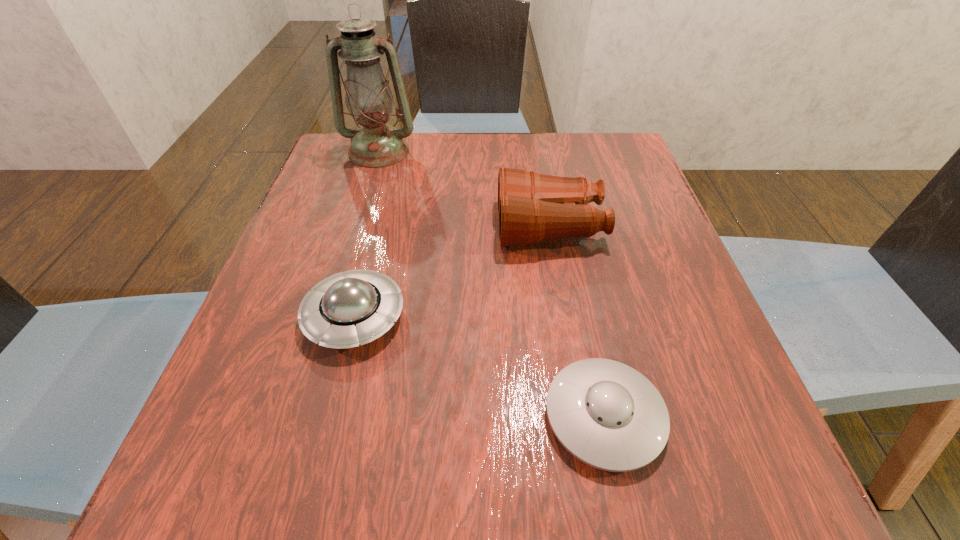
Find the location of `free region located through the lenses of the third nearest object`. free region located through the lenses of the third nearest object is located at coordinates (441, 226).

This screenshot has width=960, height=540. What are the coordinates of `vacant space located 0.260m through the lenses of the third nearest object` in the screenshot? It's located at (373, 226).

Locate an element on the screen. vacant space located 0.230m on the right of the second nearest object is located at coordinates (540, 317).

Identify the location of vacant space situated on the left of the nearer saucer. This screenshot has width=960, height=540. (320, 416).

You are a GUI agent. You are given a task and a screenshot of the screen. Output one action in this format:
    pyautogui.click(x=<x>, y=<y>)
    Task: Click on the object positioned at the far edge
    This screenshot has width=960, height=540.
    Given the screenshot: What is the action you would take?
    pyautogui.click(x=369, y=100)

The image size is (960, 540). Find the location of `object located at the near edge`. object located at the near edge is located at coordinates (605, 413).

What are the coordinates of `oil lamp present at the left edge` in the screenshot? It's located at (369, 100).

Identify the location of saucer that is positioned at the left edge. (344, 310).

This screenshot has height=540, width=960. I want to click on binoculars that is at the right edge, so click(x=532, y=207).

The width and height of the screenshot is (960, 540). I want to click on saucer located at the right edge, so click(605, 413).